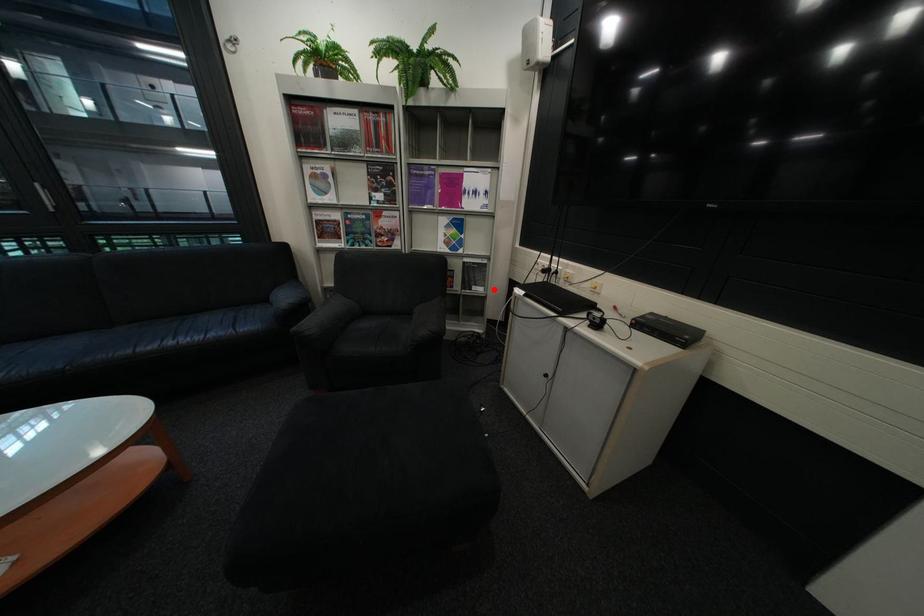
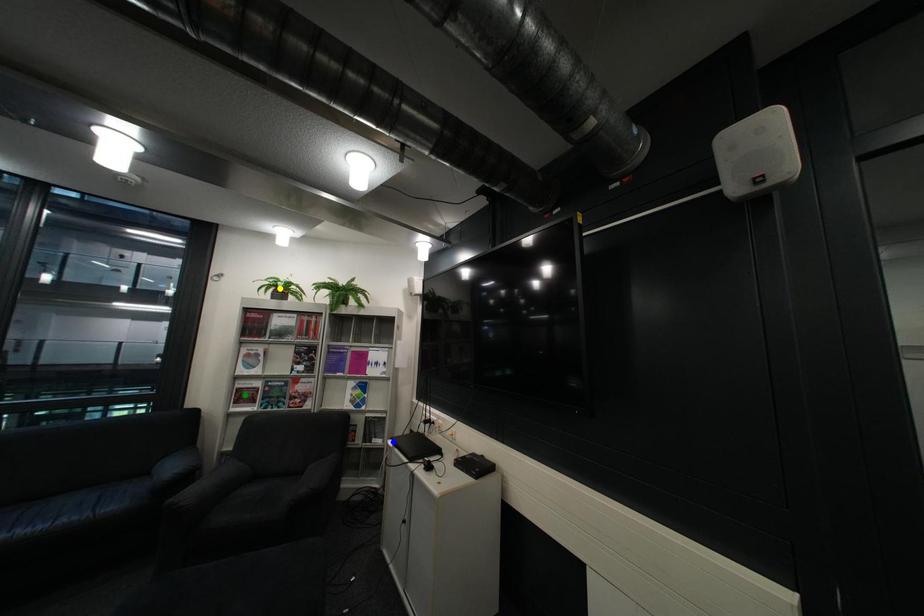
Question: I am providing you with two images of the same scene from different viewpoints. A red point is marked on the first image. You are given multiple points on the second image. Which point in image 2 represents the same 3d spot as the red point in image 1?

Choices:
 (A) yellow point
 (B) blue point
 (C) green point

Answer: (B)